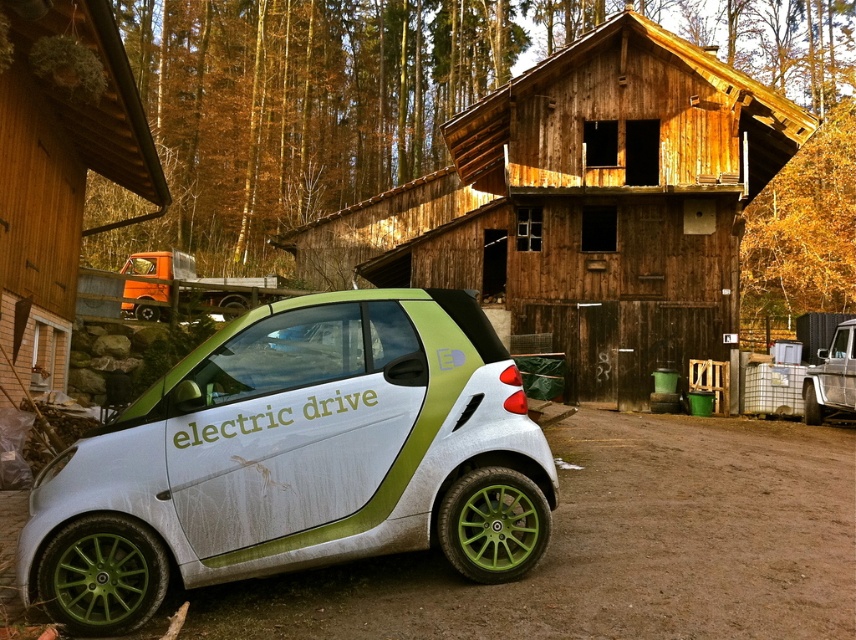
You are standing in front of the wooden cabin at center and want to see the orange matte truck at left. In which direction should you turn your head?

You should turn your head to the left to see the orange matte truck at left since it is positioned to the left of the wooden cabin at center.

You are planning to move the silver metallic car at center to a parking lot that can only accommodate vehicles smaller than the wooden cabin at center. Based on the scene description, will the car fit in the parking space?

The silver metallic car at center has a smaller size compared to the wooden cabin at center, so it will fit in the parking space designed for vehicles smaller than the cabin.